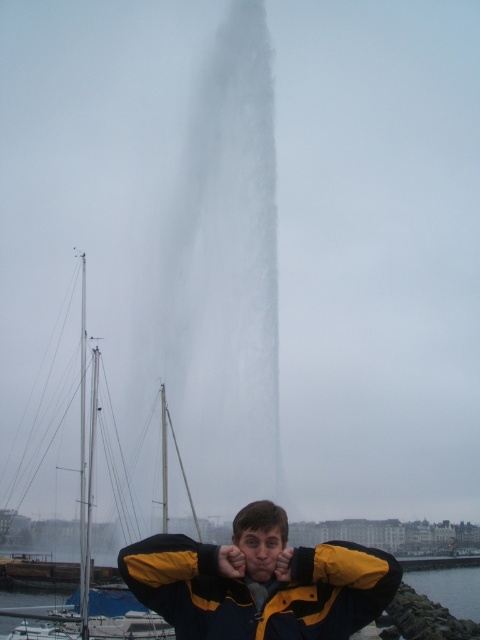
You are standing at the edge of the waterfront and see the white matte sailboat at left and the clear water at lower right. Which object is closer to you?

The white matte sailboat at left is closer to you because it is in front of the clear water at lower right, which is behind it.

You are standing at the edge of the waterfront and see both the white matte sailboat at left and the yellow matte hand at center. Which object is positioned farther to the left?

The white matte sailboat at left is positioned farther to the left than the yellow matte hand at center.